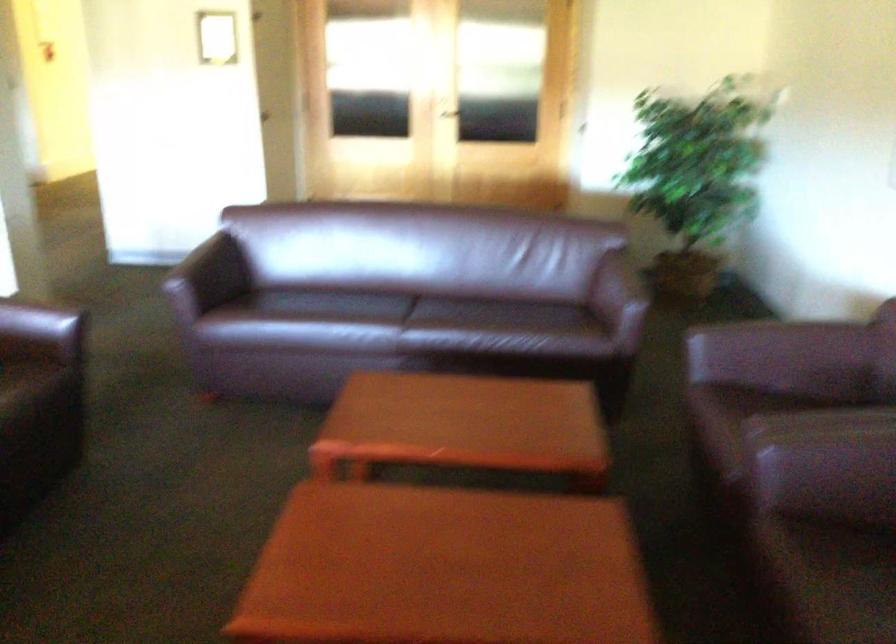
I want to click on dark door handle, so click(453, 111).